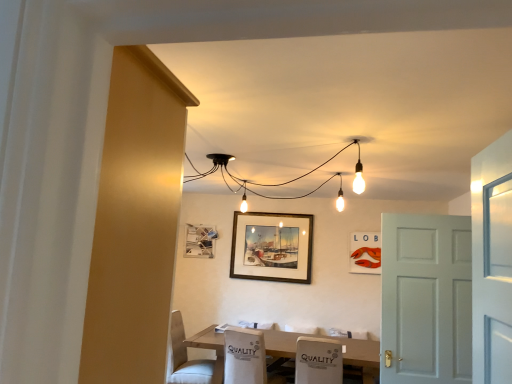
Question: Does metallic silver picture frame at lower left, marked as the first picture frame in a left-to-right arrangement, appear on the left side of white fabric armchair at lower center?

Choices:
 (A) yes
 (B) no

Answer: (A)

Question: Can you confirm if metallic silver picture frame at lower left, marked as the first picture frame in a left-to-right arrangement, is smaller than white fabric armchair at lower center?

Choices:
 (A) yes
 (B) no

Answer: (A)

Question: From a real-world perspective, is metallic silver picture frame at lower left, marked as the first picture frame in a left-to-right arrangement, positioned under white fabric armchair at lower center based on gravity?

Choices:
 (A) yes
 (B) no

Answer: (B)

Question: Is metallic silver picture frame at lower left, the third picture frame viewed from the right, far from white fabric armchair at lower center?

Choices:
 (A) yes
 (B) no

Answer: (A)

Question: From the image's perspective, does metallic silver picture frame at lower left, marked as the first picture frame in a left-to-right arrangement, appear lower than white fabric armchair at lower center?

Choices:
 (A) no
 (B) yes

Answer: (A)

Question: Is white matte door at right spatially inside matte plastic picture frame at upper right, which appears as the 1th picture frame when viewed from the right, or outside of it?

Choices:
 (A) inside
 (B) outside

Answer: (B)

Question: Relative to matte plastic picture frame at upper right, which appears as the 1th picture frame when viewed from the right, is white matte door at right in front or behind?

Choices:
 (A) front
 (B) behind

Answer: (A)

Question: Does point (398, 337) appear closer or farther from the camera than point (367, 241)?

Choices:
 (A) farther
 (B) closer

Answer: (B)

Question: From the image's perspective, is white matte door at right located above or below matte plastic picture frame at upper right, which ranks as the third picture frame in left-to-right order?

Choices:
 (A) below
 (B) above

Answer: (A)

Question: From the image's perspective, is matte plastic picture frame at upper right, which appears as the 1th picture frame when viewed from the right, above or below metallic silver picture frame at lower left, the third picture frame viewed from the right?

Choices:
 (A) below
 (B) above

Answer: (A)

Question: From their relative heights in the image, would you say matte plastic picture frame at upper right, which ranks as the third picture frame in left-to-right order, is taller or shorter than metallic silver picture frame at lower left, marked as the first picture frame in a left-to-right arrangement?

Choices:
 (A) short
 (B) tall

Answer: (B)

Question: In terms of width, does matte plastic picture frame at upper right, which appears as the 1th picture frame when viewed from the right, look wider or thinner when compared to metallic silver picture frame at lower left, the third picture frame viewed from the right?

Choices:
 (A) wide
 (B) thin

Answer: (B)

Question: Is matte plastic picture frame at upper right, which ranks as the third picture frame in left-to-right order, to the left or to the right of metallic silver picture frame at lower left, the third picture frame viewed from the right, in the image?

Choices:
 (A) left
 (B) right

Answer: (B)

Question: From a real-world perspective, is metallic silver picture frame at lower left, marked as the first picture frame in a left-to-right arrangement, positioned above or below matte plastic picture frame at upper right, which ranks as the third picture frame in left-to-right order?

Choices:
 (A) above
 (B) below

Answer: (A)

Question: Does point (212, 238) appear closer or farther from the camera than point (374, 263)?

Choices:
 (A) closer
 (B) farther

Answer: (B)